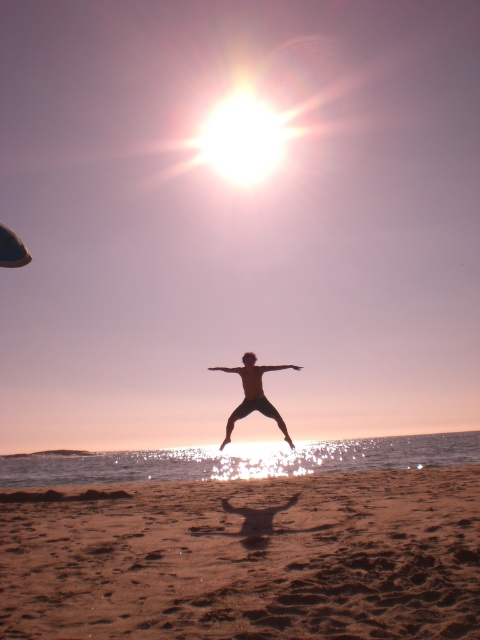
Does point (300, 573) come farther from viewer compared to point (269, 369)?

No, it is not.

Between point (250, 572) and point (254, 385), which one is positioned behind?

The point (254, 385) is more distant.

Who is more distant from viewer, (364, 550) or (266, 397)?

The point (266, 397) is more distant.

The image size is (480, 640). Identify the location of brown sandy beach at lower center. (245, 557).